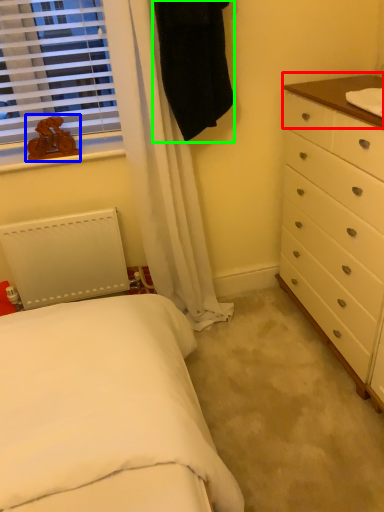
Question: Which object is positioned closest to counter top (highlighted by a red box)? Select from toy (highlighted by a blue box) and robe (highlighted by a green box).

Choices:
 (A) toy
 (B) robe

Answer: (B)